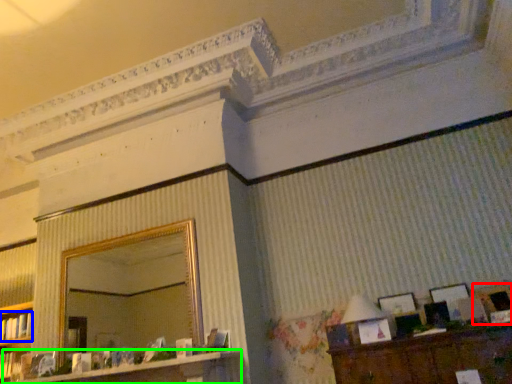
Question: Which is farther away from picture frame (highlighted by a red box)? book (highlighted by a blue box) or dresser (highlighted by a green box)?

Choices:
 (A) book
 (B) dresser

Answer: (A)